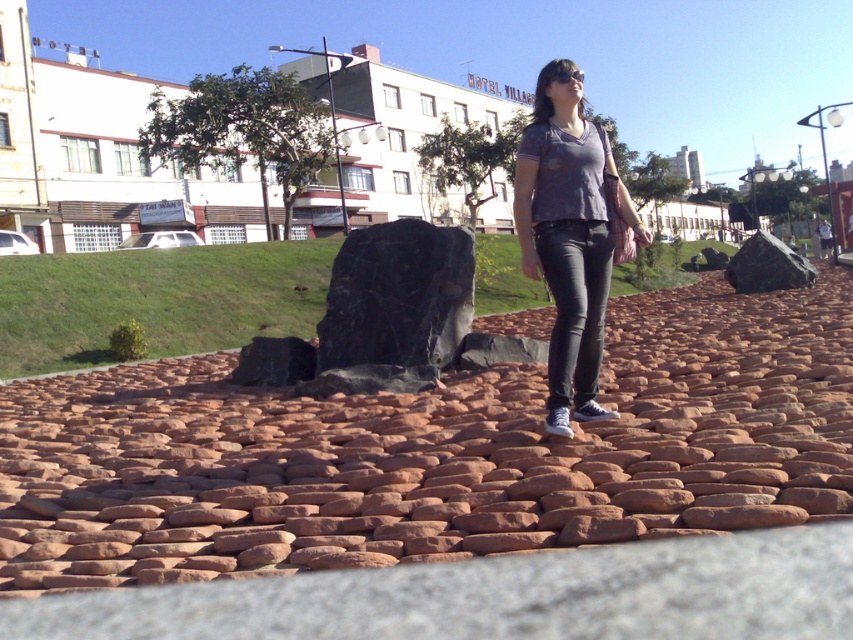
Is black polished rock at center smaller than black smooth rock at center?

Yes, black polished rock at center is smaller than black smooth rock at center.

Can you confirm if black polished rock at center is thinner than black smooth rock at center?

Yes, black polished rock at center is thinner than black smooth rock at center.

Between point (405, 232) and point (764, 248), which one is positioned in front?

Point (405, 232)

This screenshot has height=640, width=853. I want to click on black polished rock at center, so click(398, 296).

This screenshot has width=853, height=640. I want to click on brown stone pavement at center, so click(x=498, y=595).

Who is positioned more to the left, brown stone pavement at center or black polished rock at center?

From the viewer's perspective, black polished rock at center appears more on the left side.

Is point (602, 630) farther from camera compared to point (432, 284)?

No, (602, 630) is closer to viewer.

At what (x,y) coordinates should I click in order to perform the action: click on brown stone pavement at center. Please return your answer as a coordinate pair (x, y). This screenshot has height=640, width=853. Looking at the image, I should click on (498, 595).

Who is higher up, brown stone pavement at center or matte gray shirt at center?

matte gray shirt at center

Is brown stone pavement at center thinner than matte gray shirt at center?

No, brown stone pavement at center is not thinner than matte gray shirt at center.

Is point (741, 580) less distant than point (573, 308)?

Yes, it is in front of point (573, 308).

The width and height of the screenshot is (853, 640). I want to click on brown stone pavement at center, so click(498, 595).